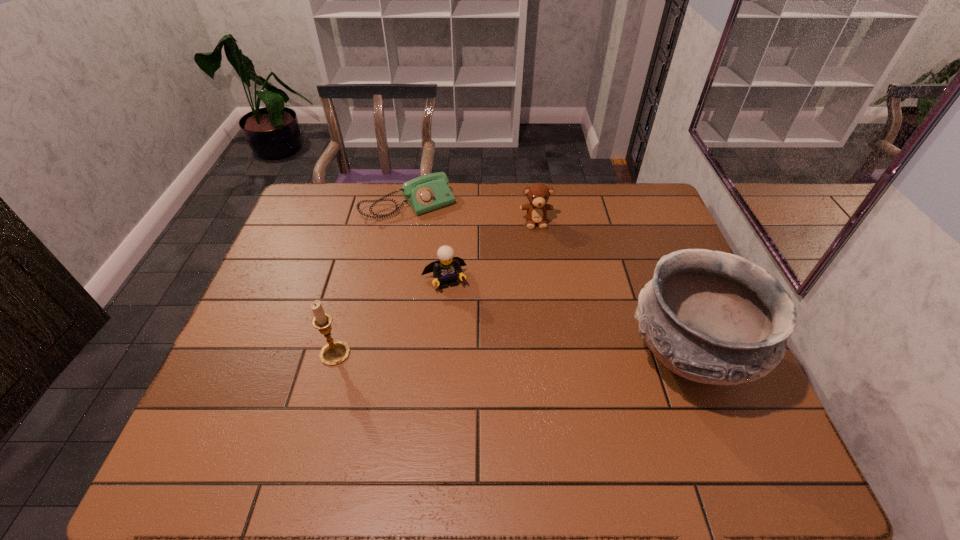
Find the location of `free space located on the face of the teddy bear`. free space located on the face of the teddy bear is located at coordinates (541, 260).

Image resolution: width=960 pixels, height=540 pixels. I want to click on free space located on the front-facing side of the Lego, so click(489, 404).

Locate an element on the screen. The height and width of the screenshot is (540, 960). vacant space located 0.310m on the front-facing side of the Lego is located at coordinates (484, 389).

Identify the location of vacant space situated on the front-facing side of the Lego. Image resolution: width=960 pixels, height=540 pixels. (461, 324).

In order to click on vacant space located on the dial of the telephone in this screenshot , I will do 460,264.

At what (x,y) coordinates should I click in order to perform the action: click on free space located 0.260m on the dial of the telephone. Please return your answer as a coordinate pair (x, y). This screenshot has width=960, height=540. Looking at the image, I should click on (465, 270).

Locate an element on the screen. Image resolution: width=960 pixels, height=540 pixels. vacant space located 0.190m on the dial of the telephone is located at coordinates (454, 255).

This screenshot has height=540, width=960. I want to click on teddy bear that is at the far edge, so click(538, 194).

This screenshot has height=540, width=960. Find the location of `telephone positioned at the far edge`. telephone positioned at the far edge is located at coordinates (428, 192).

Locate an element on the screen. object that is at the near edge is located at coordinates (712, 317).